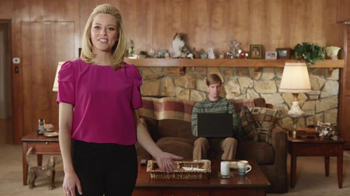
Image resolution: width=350 pixels, height=196 pixels. I want to click on figurines, so click(x=177, y=44), click(x=195, y=54), click(x=213, y=53), click(x=220, y=52), click(x=234, y=50), click(x=295, y=57), click(x=331, y=49), click(x=134, y=51), click(x=145, y=53), click(x=164, y=54).